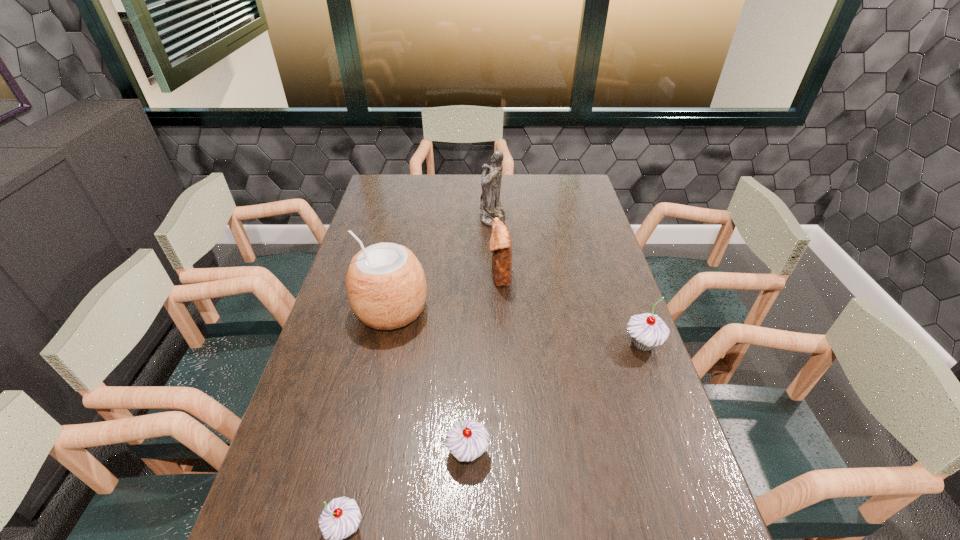
This screenshot has height=540, width=960. I want to click on vacant space at the right edge of the desktop, so coord(649,418).

At what (x,y) coordinates should I click in order to perform the action: click on free space at the far left corner of the desktop. Please return your answer as a coordinate pair (x, y). Looking at the image, I should click on (389, 189).

In the image, there is a desktop. In order to click on vacant area at the near right corner in this screenshot , I will do coord(660,526).

The image size is (960, 540). I want to click on vacant region between the clutch bag and the second nearest object, so click(484, 363).

The image size is (960, 540). Identify the location of free space between the rightmost cupcake and the second shortest cupcake. (555, 398).

Locate an element on the screen. The width and height of the screenshot is (960, 540). free area in between the figurine and the second tallest cupcake is located at coordinates (480, 334).

The height and width of the screenshot is (540, 960). Find the location of `free space between the farthest object and the fifth tallest object`. free space between the farthest object and the fifth tallest object is located at coordinates (480, 334).

Locate an element on the screen. vacant point located between the rightmost cupcake and the clutch bag is located at coordinates (571, 310).

Locate an element on the screen. blank region between the rightmost object and the second nearest object is located at coordinates (555, 398).

Where is `object that can be found as the second closest to the second cupcake from right to left`? This screenshot has height=540, width=960. object that can be found as the second closest to the second cupcake from right to left is located at coordinates (386, 285).